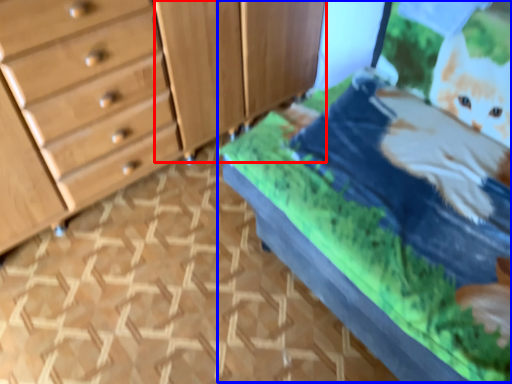
Question: Among these objects, which one is nearest to the camera, cabinetry (highlighted by a red box) or bed (highlighted by a blue box)?

Choices:
 (A) cabinetry
 (B) bed

Answer: (B)